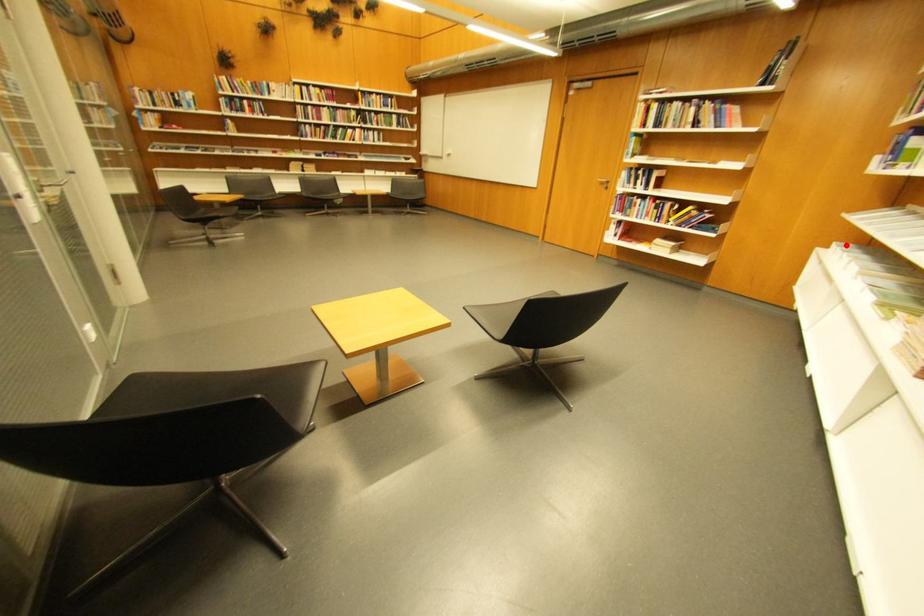
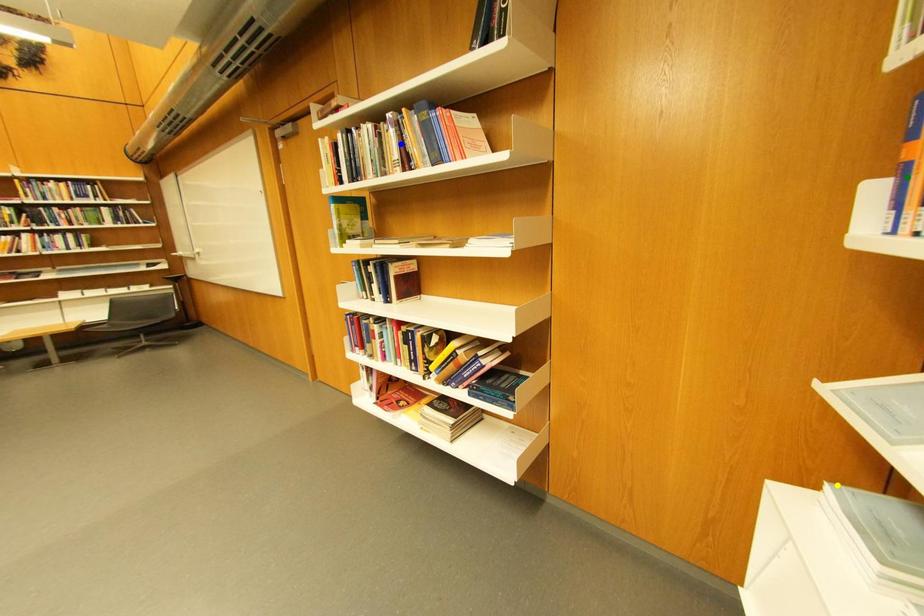
Question: I am providing you with two images of the same scene from different viewpoints. A red point is marked on the first image. You are given multiple points on the second image. Can you choose the point in image 2 that corresponds to the point in image 1?

Choices:
 (A) green point
 (B) yellow point
 (C) blue point

Answer: (B)